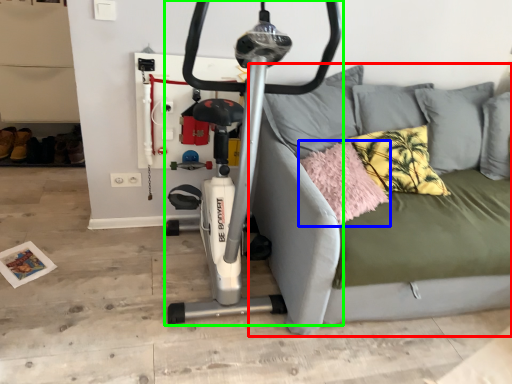
Question: Considering the real-world distances, which object is farthest from studio couch (highlighted by a red box)? pillow (highlighted by a blue box) or stationary bicycle (highlighted by a green box)?

Choices:
 (A) pillow
 (B) stationary bicycle

Answer: (B)